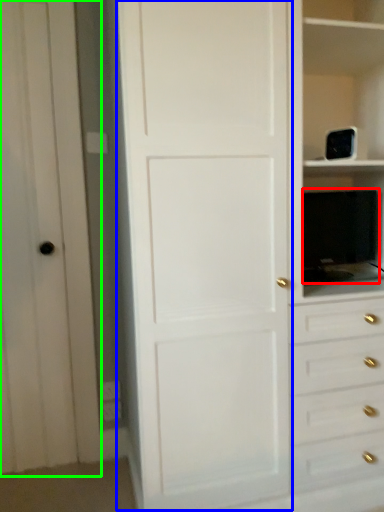
Question: Based on their relative distances, which object is farther from appliance (highlighted by a red box)? Choose from door (highlighted by a blue box) and glass door (highlighted by a green box).

Choices:
 (A) door
 (B) glass door

Answer: (B)